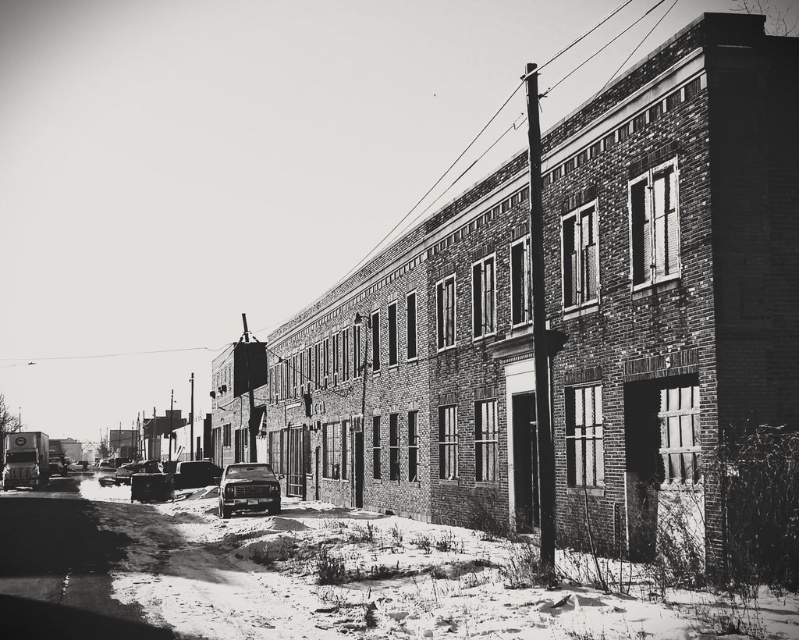
Question: Among these objects, which one is farthest from the camera?

Choices:
 (A) shiny black sedan at center
 (B) shiny black car at center

Answer: (B)

Question: Does shiny black sedan at center have a lesser width compared to shiny black car at center?

Choices:
 (A) yes
 (B) no

Answer: (A)

Question: From the image, what is the correct spatial relationship of shiny black sedan at center in relation to shiny black car at center?

Choices:
 (A) right
 (B) left

Answer: (A)

Question: Is shiny black sedan at center in front of shiny black car at center?

Choices:
 (A) no
 (B) yes

Answer: (B)